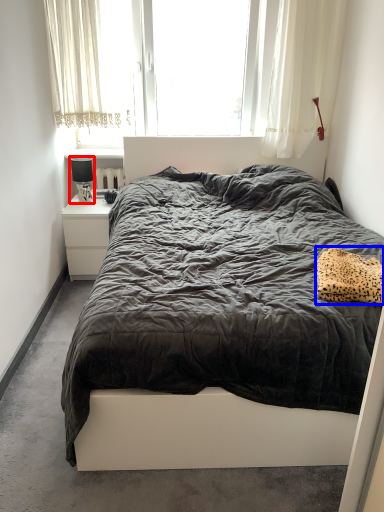
Question: Which object is further to the camera taking this photo, lamp (highlighted by a red box) or pillow (highlighted by a blue box)?

Choices:
 (A) lamp
 (B) pillow

Answer: (A)